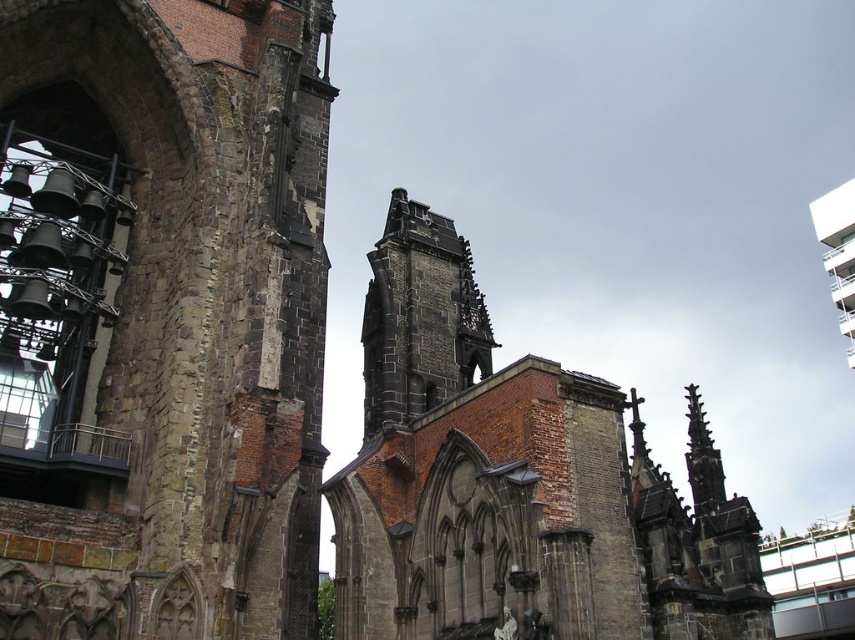
Question: In this image, where is rusty stone tower at left located relative to dark gray stone tower at center?

Choices:
 (A) below
 (B) above

Answer: (B)

Question: Is rusty stone tower at left positioned at the back of dark gray stone tower at center?

Choices:
 (A) no
 (B) yes

Answer: (A)

Question: Is rusty stone tower at left positioned behind dark gray stone tower at center?

Choices:
 (A) no
 (B) yes

Answer: (A)

Question: Which of the following is the farthest from the observer?

Choices:
 (A) dark gray stone tower at center
 (B) rusty stone tower at left

Answer: (A)

Question: Which object is farther from the camera taking this photo?

Choices:
 (A) dark gray stone tower at center
 (B) rusty stone tower at left

Answer: (A)